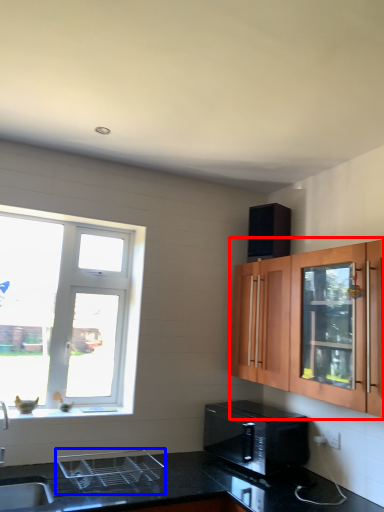
Question: Which object is closer to the camera taking this photo, cabinetry (highlighted by a red box) or appliance (highlighted by a blue box)?

Choices:
 (A) cabinetry
 (B) appliance

Answer: (A)